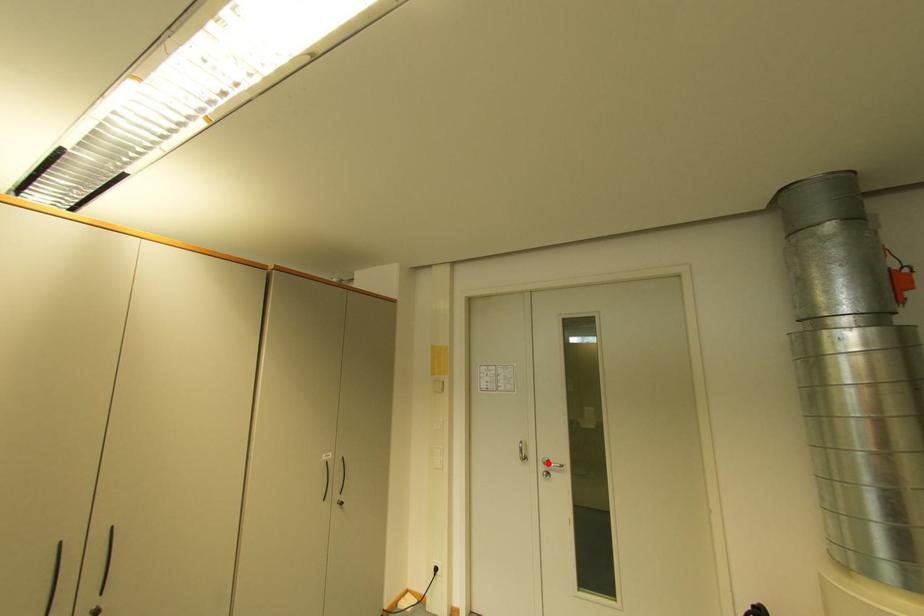
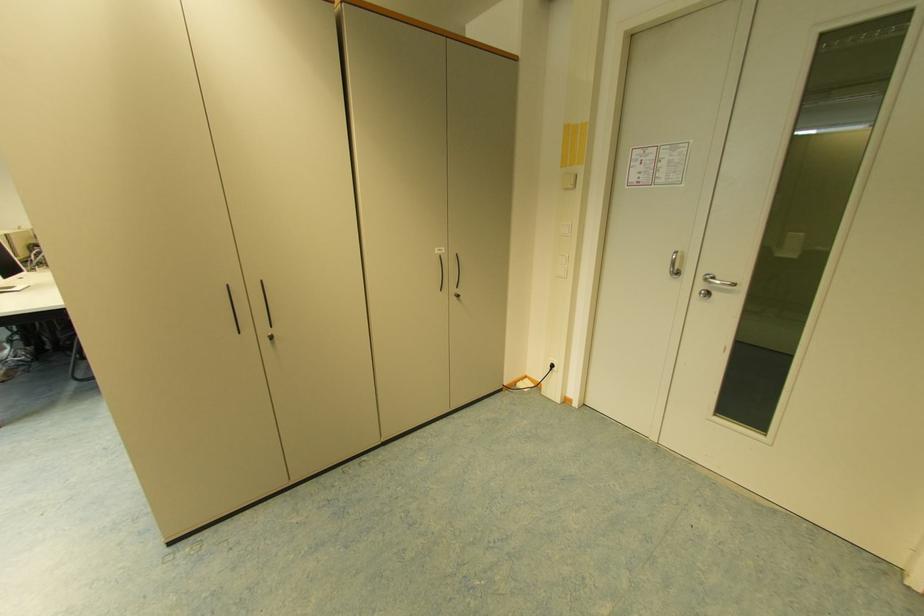
Locate, in the second image, the point that corresponds to the highlighted location in the first image.

(710, 280)